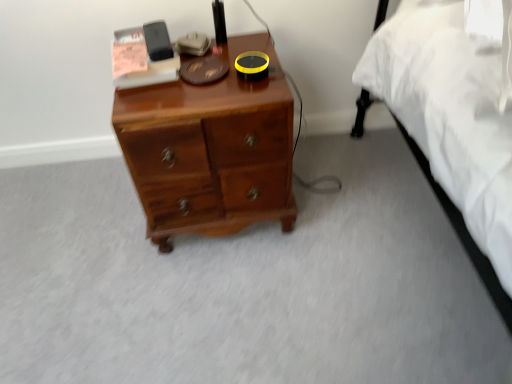
Image resolution: width=512 pixels, height=384 pixels. I want to click on shiny wood chest of drawers at center, so click(x=210, y=150).

In order to face shiny wood chest of drawers at center, should I rotate leftwards or rightwards?

A 6.552 degree turn to the left will do.

Measure the distance between point [276,55] and camera.

1.44 meters.

This screenshot has height=384, width=512. What do you see at coordinates (210, 150) in the screenshot?
I see `shiny wood chest of drawers at center` at bounding box center [210, 150].

You are a GUI agent. You are given a task and a screenshot of the screen. Output one action in this format:
    pyautogui.click(x=<x>, y=<y>)
    Task: Click on the shiny wood chest of drawers at center
    This screenshot has height=384, width=512.
    Given the screenshot: What is the action you would take?
    pyautogui.click(x=210, y=150)